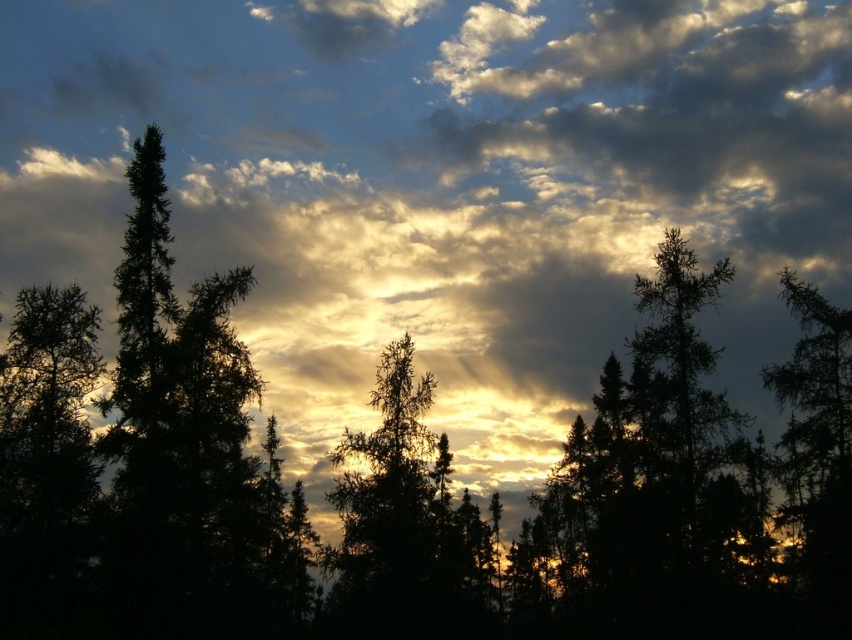
Is point (394, 356) less distant than point (798, 291)?

No, it is not.

Between silhouette pine at center and dark green textured tree at right, which one is positioned lower?

A: Positioned lower is silhouette pine at center.

Between point (404, 524) and point (804, 580), which one is positioned behind?

The point (404, 524) is behind.

Image resolution: width=852 pixels, height=640 pixels. Find the location of `silhouette pine at center`. silhouette pine at center is located at coordinates (401, 524).